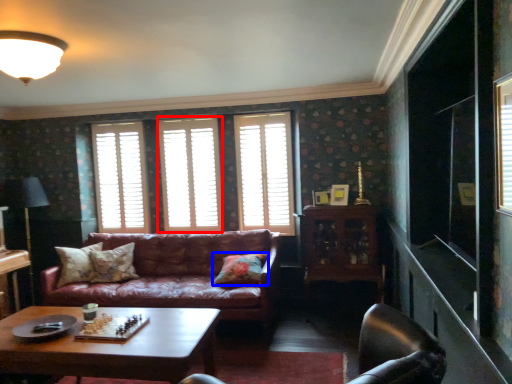
Question: Which object is further to the camera taking this photo, window (highlighted by a red box) or pillow (highlighted by a blue box)?

Choices:
 (A) window
 (B) pillow

Answer: (A)